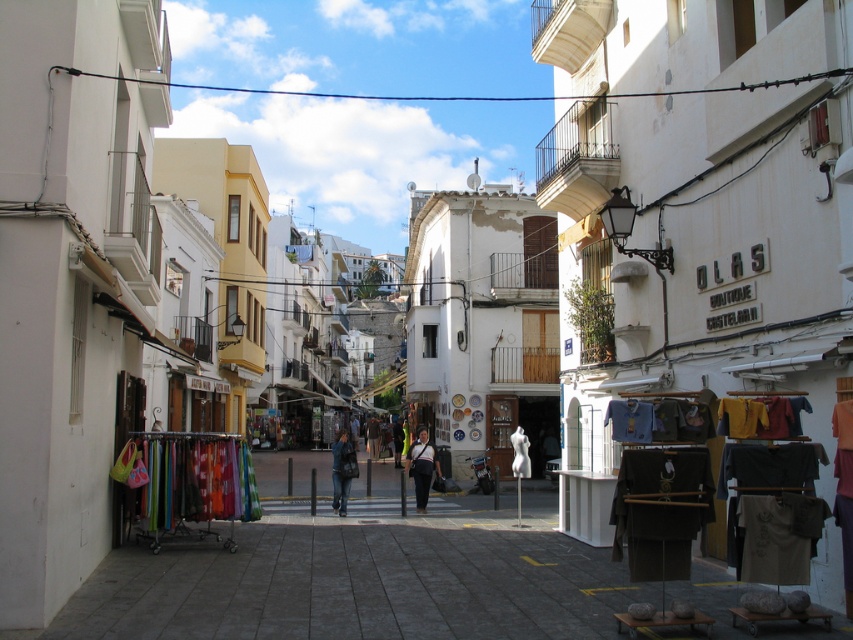
Can you confirm if textured cotton shirts at right is shorter than dark blue jeans at center?

In fact, textured cotton shirts at right may be taller than dark blue jeans at center.

Find the location of `textured cotton shirts at right`. textured cotton shirts at right is located at coordinates (766, 499).

Where is `textured cotton shirts at right`? This screenshot has height=640, width=853. textured cotton shirts at right is located at coordinates pos(766,499).

Which is below, denim jeans at center or dark blue jeans at center?

Positioned lower is dark blue jeans at center.

Which is above, denim jeans at center or dark blue jeans at center?

denim jeans at center is above.

Where is `denim jeans at center`? The image size is (853, 640). denim jeans at center is located at coordinates (341, 472).

Does textured cotton shirts at right appear on the right side of light brown leather jacket at center?

Correct, you'll find textured cotton shirts at right to the right of light brown leather jacket at center.

Can you confirm if textured cotton shirts at right is smaller than light brown leather jacket at center?

Indeed, textured cotton shirts at right has a smaller size compared to light brown leather jacket at center.

Image resolution: width=853 pixels, height=640 pixels. Find the location of `textured cotton shirts at right`. textured cotton shirts at right is located at coordinates (766, 499).

This screenshot has height=640, width=853. Identify the location of textured cotton shirts at right. (766, 499).